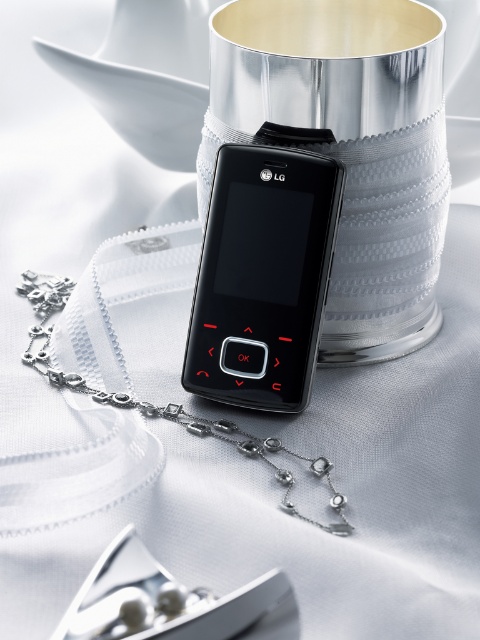
Who is more forward, (259, 163) or (135, 406)?

Point (259, 163)

Is point (323, 168) in front of point (39, 353)?

That is True.

At what (x,y) coordinates should I click in order to perform the action: click on black matte lg phone at center. Please return your answer as a coordinate pair (x, y). Looking at the image, I should click on (263, 276).